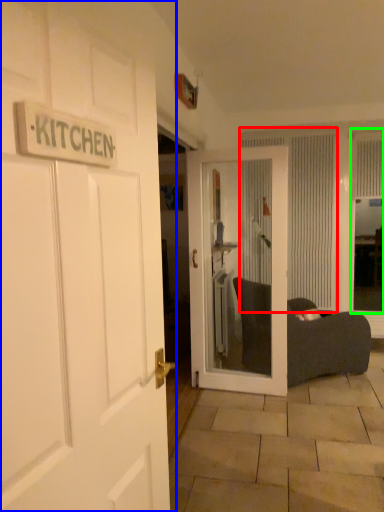
Question: Which object is positioned farthest from curtain (highlighted by a red box)? Select from door (highlighted by a blue box) and window screen (highlighted by a green box).

Choices:
 (A) door
 (B) window screen

Answer: (A)